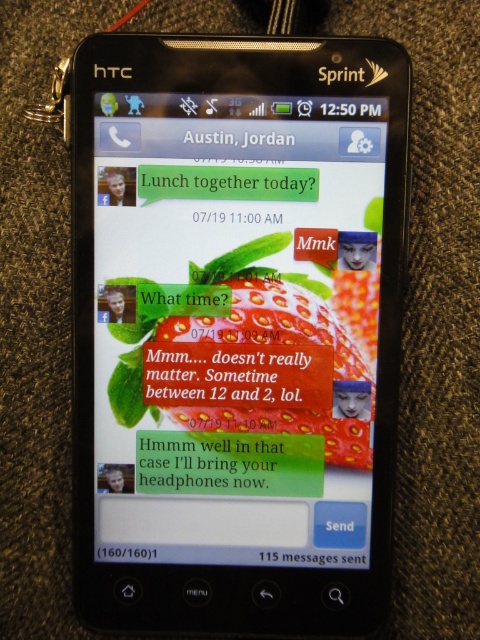
Question: Among these points, which one is nearest to the camera?

Choices:
 (A) (243, 492)
 (B) (328, 227)
 (C) (277, 394)

Answer: (B)

Question: Which point appears farthest from the camera in this image?

Choices:
 (A) (360, 330)
 (B) (250, 486)
 (C) (316, 349)

Answer: (B)

Question: Is black plastic phone at center smaller than green matte text message at center?

Choices:
 (A) no
 (B) yes

Answer: (A)

Question: Does matte plastic text message at center appear over green matte text message at center?

Choices:
 (A) yes
 (B) no

Answer: (A)

Question: Can you confirm if black plastic phone at center is positioned to the right of green matte text message at center?

Choices:
 (A) no
 (B) yes

Answer: (B)

Question: Which point is closer to the camera taking this photo?

Choices:
 (A) (84, 371)
 (B) (227, 481)

Answer: (A)